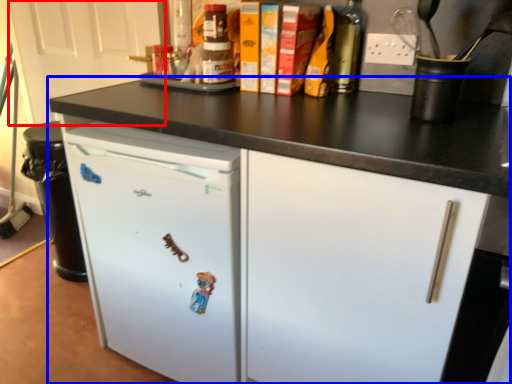
Question: Which object appears farthest to the camera in this image, door (highlighted by a red box) or cabinetry (highlighted by a blue box)?

Choices:
 (A) door
 (B) cabinetry

Answer: (A)